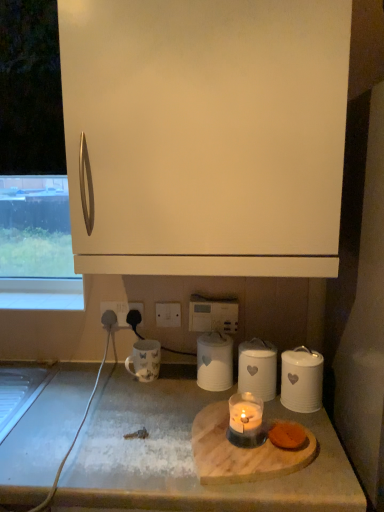
Question: Does white matte canister at center, the 2th kitchen appliance positioned from the right, have a greater height compared to white matte cabinet at upper center?

Choices:
 (A) no
 (B) yes

Answer: (A)

Question: Does white matte canister at center, the 2th kitchen appliance positioned from the right, have a smaller size compared to white matte cabinet at upper center?

Choices:
 (A) no
 (B) yes

Answer: (B)

Question: Does white matte canister at center, placed as the second kitchen appliance when sorted from left to right, appear on the right side of white matte cabinet at upper center?

Choices:
 (A) yes
 (B) no

Answer: (A)

Question: Can you confirm if white matte canister at center, placed as the second kitchen appliance when sorted from left to right, is shorter than white matte cabinet at upper center?

Choices:
 (A) no
 (B) yes

Answer: (B)

Question: Is white matte canister at center, the 2th kitchen appliance positioned from the right, turned away from white matte cabinet at upper center?

Choices:
 (A) no
 (B) yes

Answer: (A)

Question: Is white matte canister at center, placed as the second kitchen appliance when sorted from left to right, to the left of white matte cabinet at upper center from the viewer's perspective?

Choices:
 (A) yes
 (B) no

Answer: (B)

Question: Is white rubber cable at lower left smaller than black plastic outlet at lower center?

Choices:
 (A) no
 (B) yes

Answer: (A)

Question: Is the position of white rubber cable at lower left less distant than that of black plastic outlet at lower center?

Choices:
 (A) yes
 (B) no

Answer: (A)

Question: From a real-world perspective, is white rubber cable at lower left positioned under black plastic outlet at lower center based on gravity?

Choices:
 (A) yes
 (B) no

Answer: (A)

Question: Considering the relative sizes of white rubber cable at lower left and black plastic outlet at lower center in the image provided, is white rubber cable at lower left wider than black plastic outlet at lower center?

Choices:
 (A) yes
 (B) no

Answer: (A)

Question: Would you say white rubber cable at lower left is outside black plastic outlet at lower center?

Choices:
 (A) yes
 (B) no

Answer: (A)

Question: Does white rubber cable at lower left appear on the left side of black plastic outlet at lower center?

Choices:
 (A) no
 (B) yes

Answer: (B)

Question: From the image's perspective, is white matte cabinet at upper center above white ceramic canister at center, which appears as the 3th kitchen appliance when viewed from the right?

Choices:
 (A) no
 (B) yes

Answer: (B)